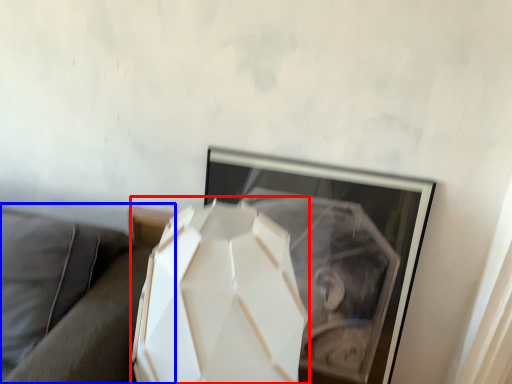
Question: Which of the following is the closest to the observer, lamp (highlighted by a red box) or couch (highlighted by a blue box)?

Choices:
 (A) lamp
 (B) couch

Answer: (A)